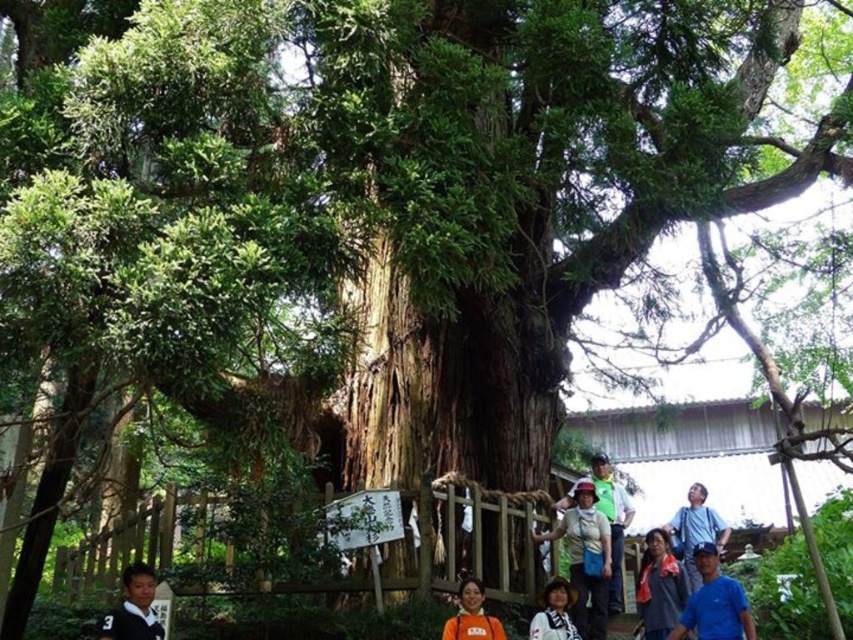
Does blue fabric shirt at lower right come behind matte green hat at center?

No, it is in front of matte green hat at center.

What do you see at coordinates (714, 602) in the screenshot? This screenshot has width=853, height=640. I see `blue fabric shirt at lower right` at bounding box center [714, 602].

Find the location of a particular element. Image resolution: width=853 pixels, height=640 pixels. blue fabric shirt at lower right is located at coordinates (714, 602).

Which is more to the right, matte blue shirt at center or matte black shirt at lower center?

matte black shirt at lower center

Is point (601, 625) positioned in front of point (674, 596)?

That is True.

This screenshot has width=853, height=640. I want to click on matte blue shirt at center, so click(585, 560).

Is matte blue shirt at center thinner than matte black shirt at lower left?

In fact, matte blue shirt at center might be wider than matte black shirt at lower left.

How far apart are matte blue shirt at center and matte black shirt at lower left?

3.78 meters

Does point (595, 545) come behind point (123, 637)?

Yes.

Where is `matte blue shirt at center`? Image resolution: width=853 pixels, height=640 pixels. matte blue shirt at center is located at coordinates (585, 560).